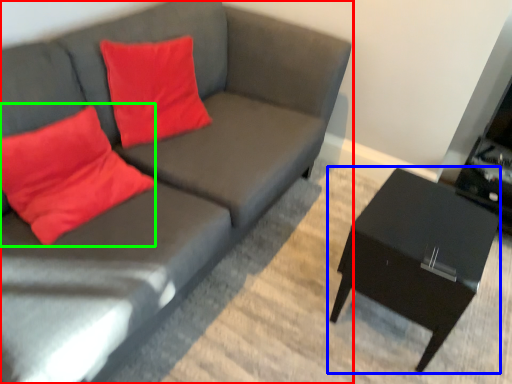
Question: Based on their relative distances, which object is nearer to studio couch (highlighted by a red box)? Choose from table (highlighted by a blue box) and throw pillow (highlighted by a green box).

Choices:
 (A) table
 (B) throw pillow

Answer: (B)